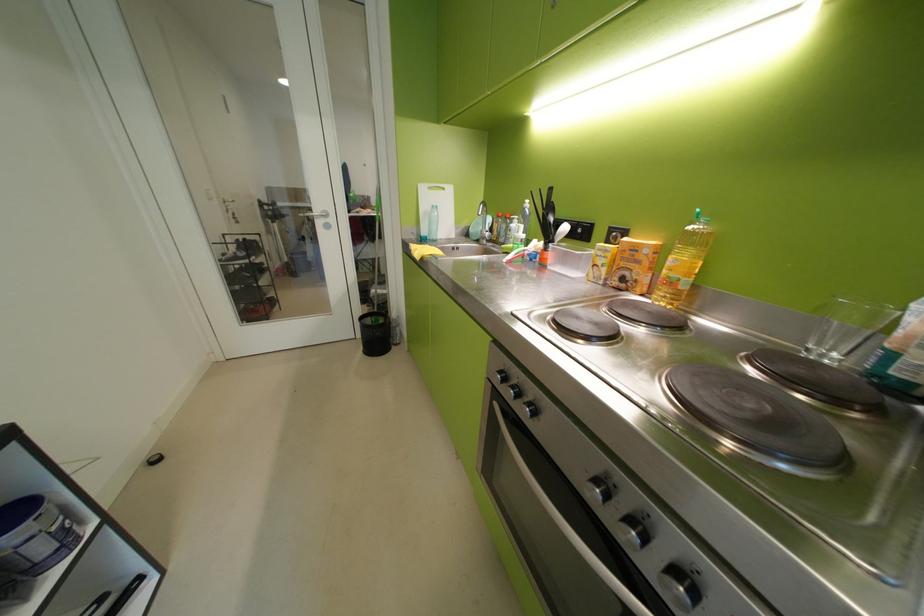
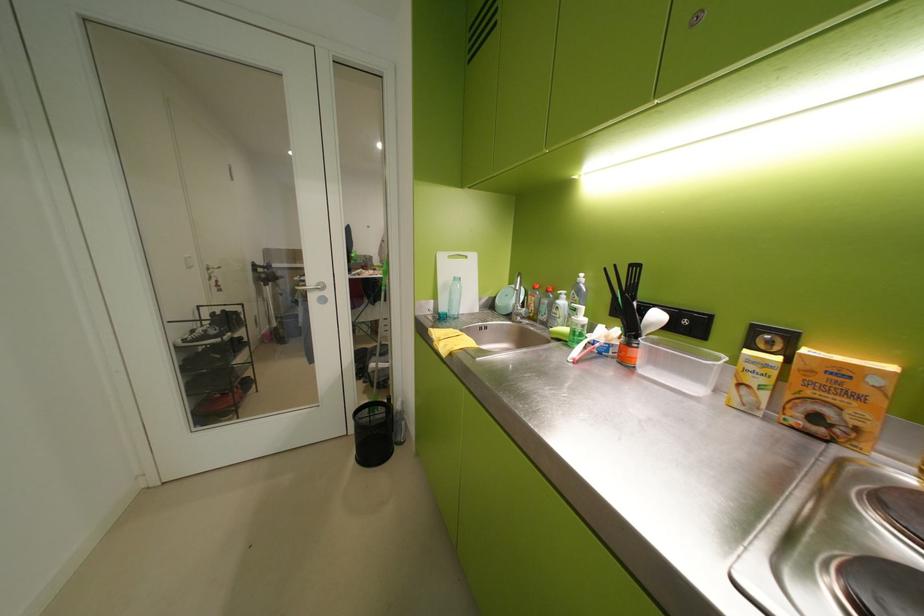
In the second image, find the point that corresponds to point 576,229 in the first image.

(667, 317)